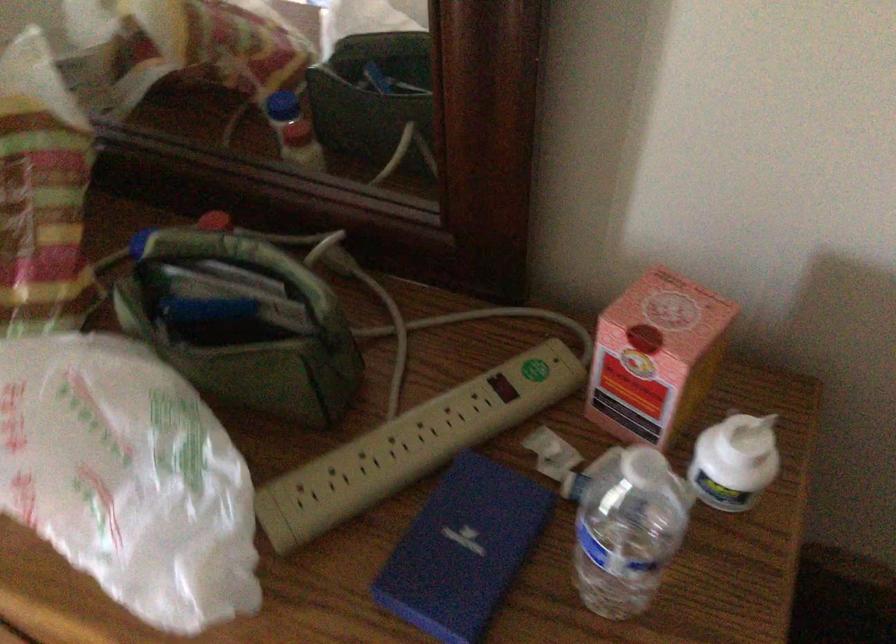
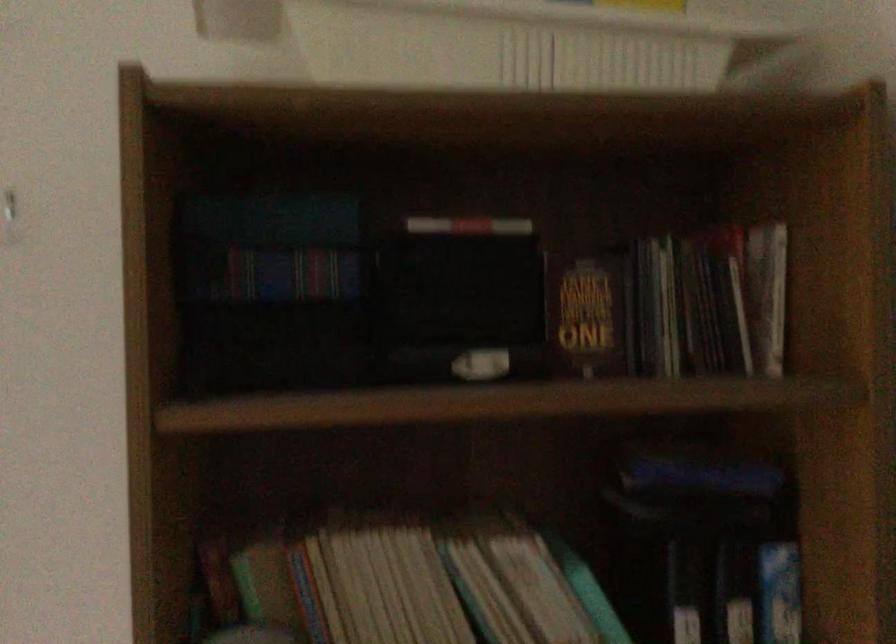
The first image is from the beginning of the video and the second image is from the end. How did the camera likely rotate when shooting the video?

The camera rotated toward left-up.